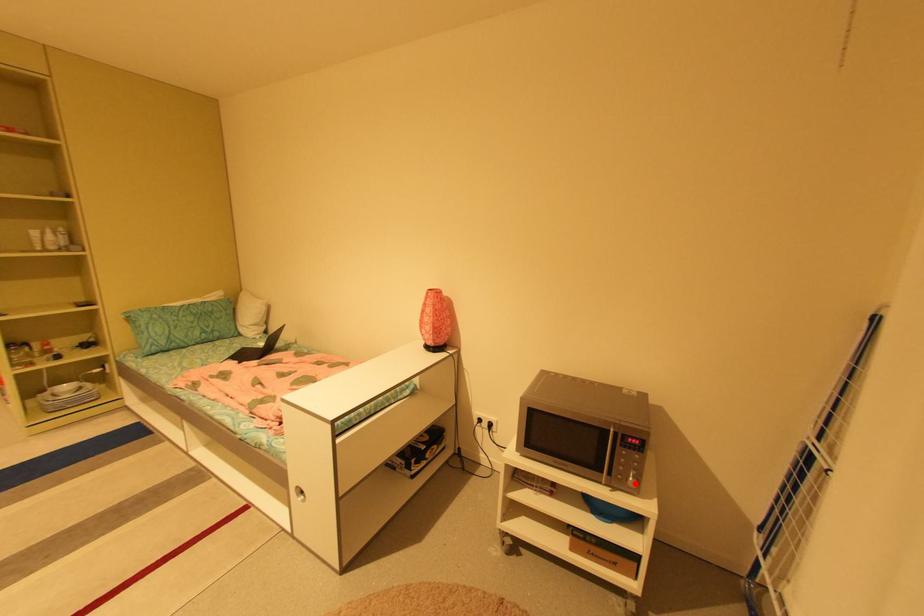
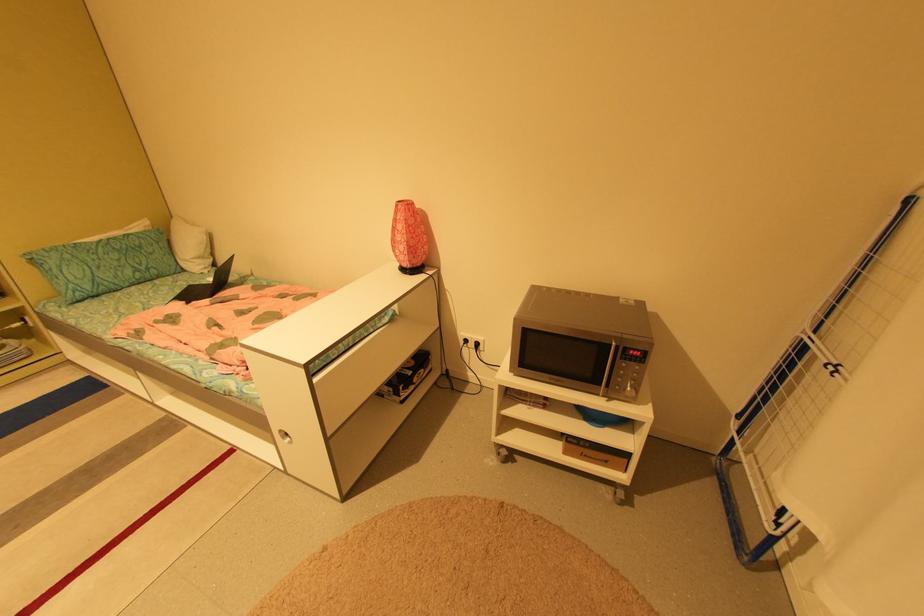
Where in the second image is the point corresponding to the highlighted location from the first image?

(633, 394)